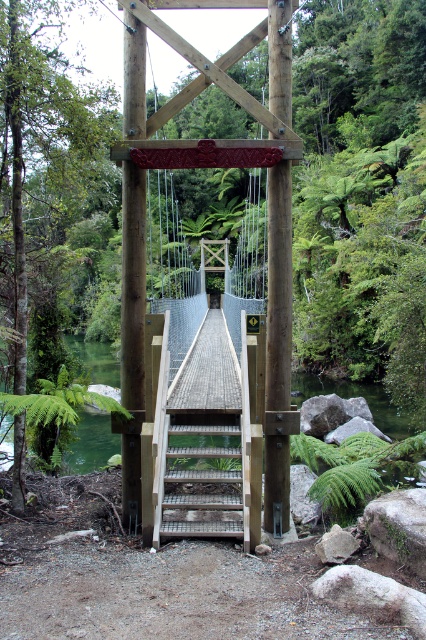
Is wooden suspension bridge at center bigger than green water at center?

No, wooden suspension bridge at center is not bigger than green water at center.

This screenshot has width=426, height=640. What do you see at coordinates (224, 324) in the screenshot? I see `wooden suspension bridge at center` at bounding box center [224, 324].

Is point (229, 506) closer to viewer compared to point (117, 385)?

Yes, it is.

The width and height of the screenshot is (426, 640). Identify the location of wooden suspension bridge at center. (224, 324).

Can you confirm if wooden stairs at center is bigger than green water at center?

Actually, wooden stairs at center might be smaller than green water at center.

Who is more forward, [238,451] or [104,349]?

Point [238,451] is more forward.

The height and width of the screenshot is (640, 426). Find the location of `wooden stairs at center`. wooden stairs at center is located at coordinates (206, 483).

Who is taller, wooden suspension bridge at center or wooden stairs at center?

wooden suspension bridge at center is taller.

Which is more to the right, wooden suspension bridge at center or wooden stairs at center?

wooden stairs at center

Is point (290, 164) more distant than point (201, 529)?

That is True.

In order to click on wooden suspension bridge at center in this screenshot , I will do `click(224, 324)`.